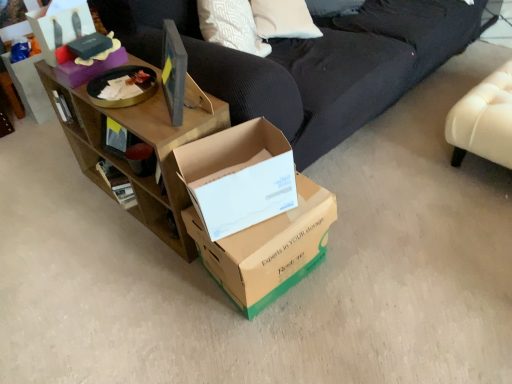
Question: Considering the positions of cardboard box at center, which is counted as the 2th box, starting from the left, and brown wood shelf at upper left in the image, is cardboard box at center, which is counted as the 2th box, starting from the left, taller or shorter than brown wood shelf at upper left?

Choices:
 (A) tall
 (B) short

Answer: (B)

Question: Does point (236, 147) appear closer or farther from the camera than point (226, 114)?

Choices:
 (A) farther
 (B) closer

Answer: (B)

Question: Based on their relative distances, which object is nearer to the brown wood shelf at upper left?

Choices:
 (A) brown cardboard box at center, positioned as the third box in left-to-right order
 (B) cardboard box at center, which is counted as the 2th box, starting from the left
 (C) matte black box at upper left, acting as the 3th box starting from the right
 (D) leather ottoman at right

Answer: (B)

Question: Estimate the real-world distances between objects in this image. Which object is farther from the cardboard box at center, which is counted as the 2th box, starting from the left?

Choices:
 (A) leather ottoman at right
 (B) brown cardboard box at center, which appears as the 1th box when ordered from the bottom
 (C) brown wood shelf at upper left
 (D) matte black box at upper left, placed as the 1th box when sorted from top to bottom

Answer: (A)